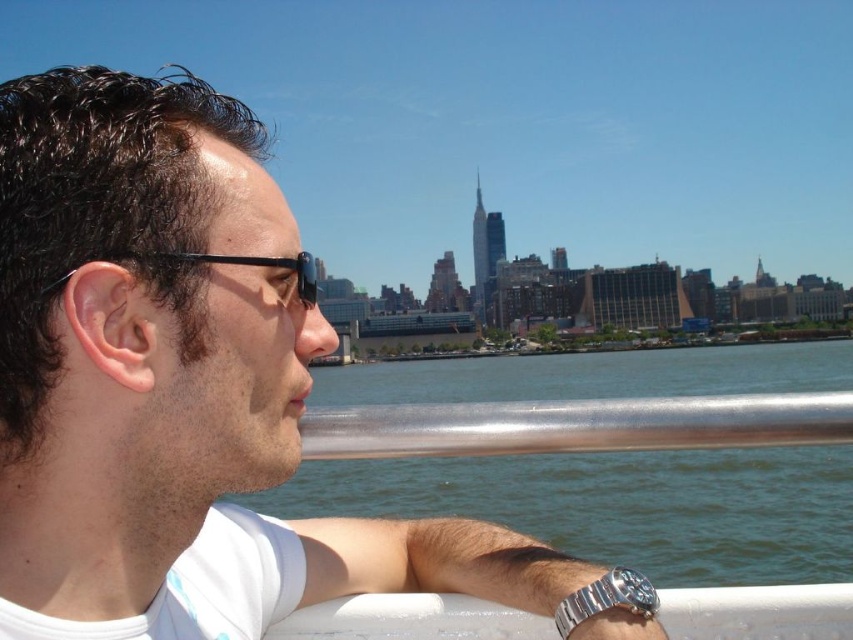
Does silver metallic watch at lower right appear on the right side of black plastic goggles at left?

Yes, silver metallic watch at lower right is to the right of black plastic goggles at left.

Describe the element at coordinates (607, 598) in the screenshot. I see `silver metallic watch at lower right` at that location.

Between point (579, 614) and point (163, 257), which one is positioned behind?

The point (163, 257) is more distant.

The height and width of the screenshot is (640, 853). Identify the location of silver metallic watch at lower right. pos(607,598).

At what (x,y) coordinates should I click in order to perform the action: click on white matte shirt at center. Please return your answer as a coordinate pair (x, y). Looking at the image, I should click on (177, 385).

Does white matte shirt at center have a greater width compared to silver metallic rail at center?

In fact, white matte shirt at center might be narrower than silver metallic rail at center.

This screenshot has width=853, height=640. In order to click on white matte shirt at center in this screenshot , I will do `click(177, 385)`.

Which is more to the left, clear blue water at center or silver metallic rail at center?

From the viewer's perspective, silver metallic rail at center appears more on the left side.

What do you see at coordinates (619, 506) in the screenshot? I see `clear blue water at center` at bounding box center [619, 506].

Find the location of a particular element. The height and width of the screenshot is (640, 853). clear blue water at center is located at coordinates (619, 506).

You are a GUI agent. You are given a task and a screenshot of the screen. Output one action in this format:
    pyautogui.click(x=<x>, y=<y>)
    Task: Click on the clear blue water at center
    This screenshot has width=853, height=640.
    Given the screenshot: What is the action you would take?
    [x=619, y=506]